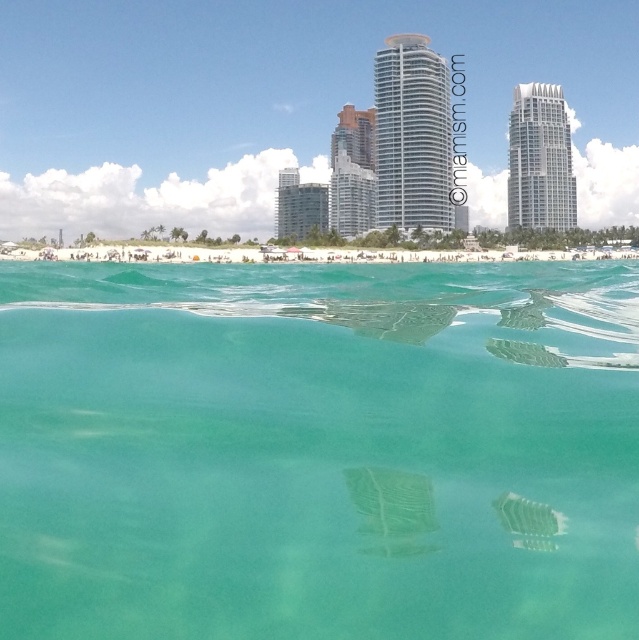
You are a photographer taking a picture of the clear glass skyscraper at center and the clear glass water at center. Which object will appear closer to the bottom of your camera frame?

The clear glass water at center is located below the clear glass skyscraper at center, so it will appear closer to the bottom of the camera frame.

From the picture: You are a photographer trying to capture the clear glass skyscraper at center through the clear glass water at center. Will the skyscraper be visible in your photo?

The clear glass water at center is in front of the clear glass skyscraper at center, so the skyscraper will be visible through the water as they are both clear and positioned in a way that allows visibility.